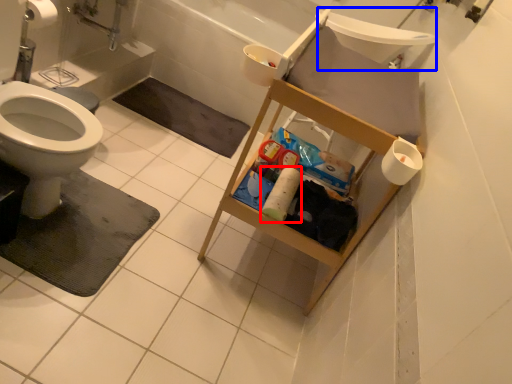
Question: Which of the following is the closest to the observer, toilet paper (highlighted by a red box) or sink (highlighted by a blue box)?

Choices:
 (A) toilet paper
 (B) sink

Answer: (A)